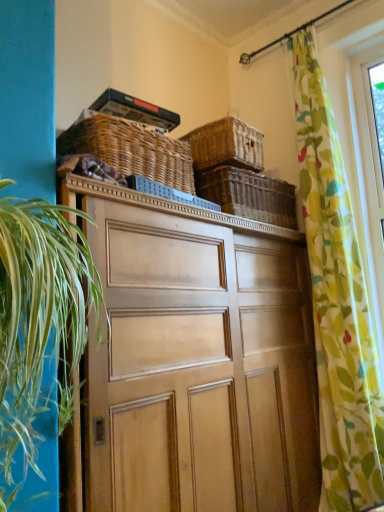
What is the approximate width of woven brown basket at upper center, marked as the third basket in a right-to-left arrangement?

16.12 inches.

In order to face woven brown basket at upper center, positioned as the first basket in left-to-right order, should I rotate leftwards or rightwards?

Turn left approximately 8.993 degrees to face it.

The height and width of the screenshot is (512, 384). Find the location of `green leafy plant at left`. green leafy plant at left is located at coordinates (39, 319).

Find the location of `floral fabric curtain at right`. floral fabric curtain at right is located at coordinates (337, 302).

Identify the location of woven brown basket at upper center, positioned as the first basket in left-to-right order. This screenshot has height=512, width=384. (131, 150).

Would you say woven brown basket at upper center, which is counted as the 2th basket, starting from the left, is part of floral fabric curtain at right's contents?

No, woven brown basket at upper center, which is counted as the 2th basket, starting from the left, is located outside of floral fabric curtain at right.

Is floral fabric curtain at right turned away from woven brown basket at upper center, which is the 2th basket in right-to-left order?

No.

Based on the photo, is floral fabric curtain at right with woven brown basket at upper center, which is the 2th basket in right-to-left order?

floral fabric curtain at right and woven brown basket at upper center, which is the 2th basket in right-to-left order, are clearly separated.

Is green leafy plant at left bigger than woven wicker basket at upper center, the third basket when ordered from left to right?

Yes.

Do you think green leafy plant at left is within woven wicker basket at upper center, the third basket when ordered from left to right, or outside of it?

green leafy plant at left is spatially situated outside woven wicker basket at upper center, the third basket when ordered from left to right.

In the image, is green leafy plant at left positioned in front of or behind woven wicker basket at upper center, the third basket when ordered from left to right?

Visually, green leafy plant at left is located in front of woven wicker basket at upper center, the third basket when ordered from left to right.

Identify the location of vegetation lying in front of the woven wicker basket at upper center, the third basket when ordered from left to right. This screenshot has height=512, width=384. (39, 319).

Is woven brown basket at upper center, marked as the third basket in a right-to-left arrangement, completely or partially outside of woven wicker basket at upper center, the third basket when ordered from left to right?

That's correct, woven brown basket at upper center, marked as the third basket in a right-to-left arrangement, is outside of woven wicker basket at upper center, the third basket when ordered from left to right.

Which object is positioned more to the left, woven brown basket at upper center, marked as the third basket in a right-to-left arrangement, or woven wicker basket at upper center, the third basket when ordered from left to right?

From the viewer's perspective, woven brown basket at upper center, marked as the third basket in a right-to-left arrangement, appears more on the left side.

Measure the distance between woven brown basket at upper center, marked as the third basket in a right-to-left arrangement, and woven wicker basket at upper center, the third basket when ordered from left to right.

woven brown basket at upper center, marked as the third basket in a right-to-left arrangement, is 18.27 inches away from woven wicker basket at upper center, the third basket when ordered from left to right.

Considering the points (90, 152) and (210, 177), which point is in front, point (90, 152) or point (210, 177)?

The point (90, 152) is in front.

Would you say wooden cabinet at center is outside woven brown basket at upper center, marked as the third basket in a right-to-left arrangement?

wooden cabinet at center is positioned outside woven brown basket at upper center, marked as the third basket in a right-to-left arrangement.

Measure the distance between wooden cabinet at center and woven brown basket at upper center, marked as the third basket in a right-to-left arrangement.

wooden cabinet at center is 62.79 centimeters away from woven brown basket at upper center, marked as the third basket in a right-to-left arrangement.

Looking at this image, is wooden cabinet at center bigger or smaller than woven brown basket at upper center, marked as the third basket in a right-to-left arrangement?

Clearly, wooden cabinet at center is larger in size than woven brown basket at upper center, marked as the third basket in a right-to-left arrangement.

From the image's perspective, is wooden cabinet at center on woven brown basket at upper center, positioned as the first basket in left-to-right order?

No, from the image's perspective, wooden cabinet at center is not on top of woven brown basket at upper center, positioned as the first basket in left-to-right order.

Is woven wicker basket at upper center, the third basket when ordered from left to right, smaller than floral fabric curtain at right?

Yes, woven wicker basket at upper center, the third basket when ordered from left to right, is smaller than floral fabric curtain at right.

From a real-world perspective, which is physically above, woven wicker basket at upper center, the 1th basket when ordered from right to left, or floral fabric curtain at right?

In real-world perspective, woven wicker basket at upper center, the 1th basket when ordered from right to left, is above.

Is woven wicker basket at upper center, the 1th basket when ordered from right to left, oriented away from floral fabric curtain at right?

No, woven wicker basket at upper center, the 1th basket when ordered from right to left, is not facing the opposite direction of floral fabric curtain at right.

Where is `basket in front of the floral fabric curtain at right`? This screenshot has height=512, width=384. basket in front of the floral fabric curtain at right is located at coordinates tap(131, 150).

Does woven brown basket at upper center, positioned as the first basket in left-to-right order, have a smaller size compared to floral fabric curtain at right?

Indeed, woven brown basket at upper center, positioned as the first basket in left-to-right order, has a smaller size compared to floral fabric curtain at right.

Between woven brown basket at upper center, positioned as the first basket in left-to-right order, and floral fabric curtain at right, which one has smaller width?

Thinner between the two is floral fabric curtain at right.

Does point (173, 177) appear closer or farther from the camera than point (360, 458)?

Clearly, point (173, 177) is closer to the camera than point (360, 458).

From the picture: Is green leafy plant at left taller or shorter than wooden cabinet at center?

In the image, green leafy plant at left appears to be shorter than wooden cabinet at center.

Can you see green leafy plant at left touching wooden cabinet at center?

No.

Choose the correct answer: Is green leafy plant at left inside wooden cabinet at center or outside it?

green leafy plant at left is not enclosed by wooden cabinet at center.

Is point (77, 213) in front of point (108, 480)?

Yes, point (77, 213) is closer to viewer.

From the floral fabric curtain at right, count 1st baskets backward and point to it. Please provide its 2D coordinates.

[(226, 145)]

Locate an element on the screen. The height and width of the screenshot is (512, 384). vegetation on the left of the woven wicker basket at upper center, the third basket when ordered from left to right is located at coordinates (39, 319).

Considering their positions, is woven brown basket at upper center, which is counted as the 2th basket, starting from the left, positioned closer to green leafy plant at left than floral fabric curtain at right?

woven brown basket at upper center, which is counted as the 2th basket, starting from the left, lies closer to green leafy plant at left than the other object.

From the image, which object appears to be farther from green leafy plant at left, woven wicker basket at upper center, the third basket when ordered from left to right, or floral fabric curtain at right?

Based on the image, floral fabric curtain at right appears to be further to green leafy plant at left.

Based on their spatial positions, is floral fabric curtain at right or woven wicker basket at upper center, the 1th basket when ordered from right to left, closer to woven brown basket at upper center, positioned as the first basket in left-to-right order?

woven wicker basket at upper center, the 1th basket when ordered from right to left, is closer to woven brown basket at upper center, positioned as the first basket in left-to-right order.

Estimate the real-world distances between objects in this image. Which object is further from wooden cabinet at center, woven wicker basket at upper center, the 1th basket when ordered from right to left, or floral fabric curtain at right?

floral fabric curtain at right.

Estimate the real-world distances between objects in this image. Which object is closer to green leafy plant at left, wooden cabinet at center or woven brown basket at upper center, which is counted as the 2th basket, starting from the left?

wooden cabinet at center lies closer to green leafy plant at left than the other object.

When comparing their distances from woven brown basket at upper center, which is counted as the 2th basket, starting from the left, does woven brown basket at upper center, positioned as the first basket in left-to-right order, or green leafy plant at left seem closer?

Based on the image, woven brown basket at upper center, positioned as the first basket in left-to-right order, appears to be nearer to woven brown basket at upper center, which is counted as the 2th basket, starting from the left.

When comparing their distances from woven wicker basket at upper center, the 1th basket when ordered from right to left, does woven brown basket at upper center, marked as the third basket in a right-to-left arrangement, or floral fabric curtain at right seem further?

The object further to woven wicker basket at upper center, the 1th basket when ordered from right to left, is floral fabric curtain at right.

From the image, which object appears to be farther from wooden cabinet at center, woven brown basket at upper center, which is the 2th basket in right-to-left order, or woven wicker basket at upper center, the third basket when ordered from left to right?

woven brown basket at upper center, which is the 2th basket in right-to-left order, is further to wooden cabinet at center.

This screenshot has width=384, height=512. What are the coordinates of `cabinetry between green leafy plant at left and woven wicker basket at upper center, the third basket when ordered from left to right, from front to back` in the screenshot? It's located at (197, 360).

At what (x,y) coordinates should I click in order to perform the action: click on basket between green leafy plant at left and floral fabric curtain at right in the front-back direction. Please return your answer as a coordinate pair (x, y). The image size is (384, 512). Looking at the image, I should click on (131, 150).

At what (x,y) coordinates should I click in order to perform the action: click on basket between woven brown basket at upper center, positioned as the first basket in left-to-right order, and woven wicker basket at upper center, the 1th basket when ordered from right to left, from left to right. Please return your answer as a coordinate pair (x, y). The width and height of the screenshot is (384, 512). Looking at the image, I should click on (226, 145).

The image size is (384, 512). I want to click on basket located between woven brown basket at upper center, which is counted as the 2th basket, starting from the left, and floral fabric curtain at right in the left-right direction, so click(249, 195).